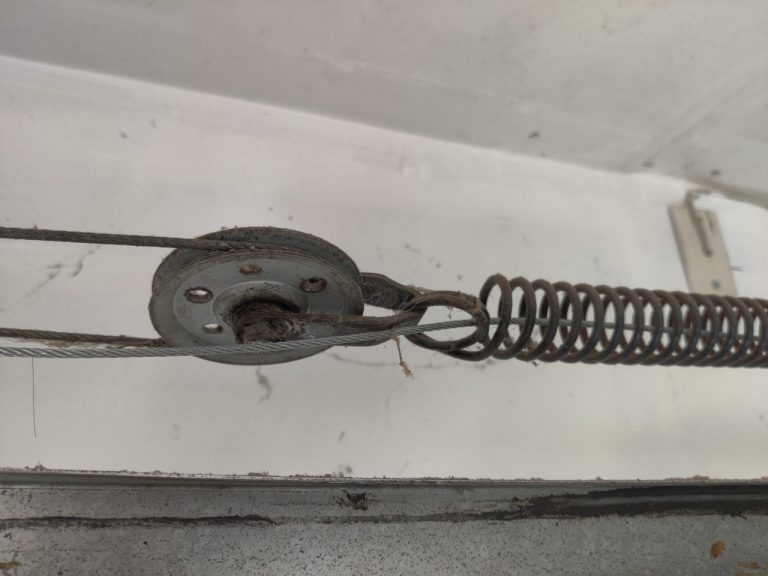
What are the coordinates of `cable` in the screenshot? It's located at (113, 350).